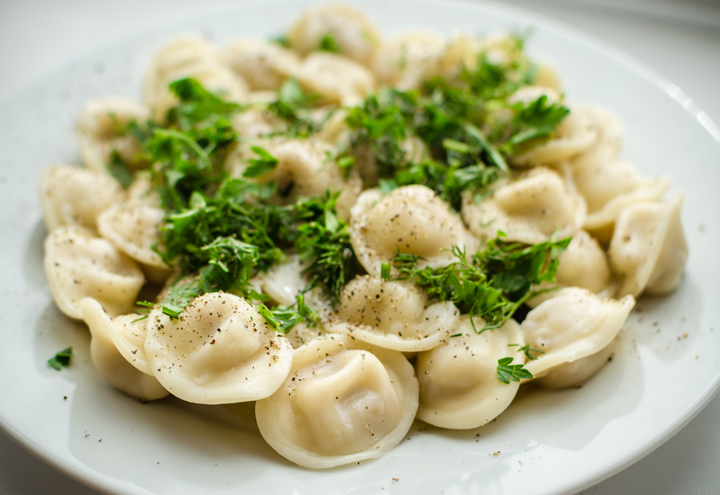
Find the location of a particular element. The height and width of the screenshot is (495, 720). white table to upper right of plate is located at coordinates (688, 66).